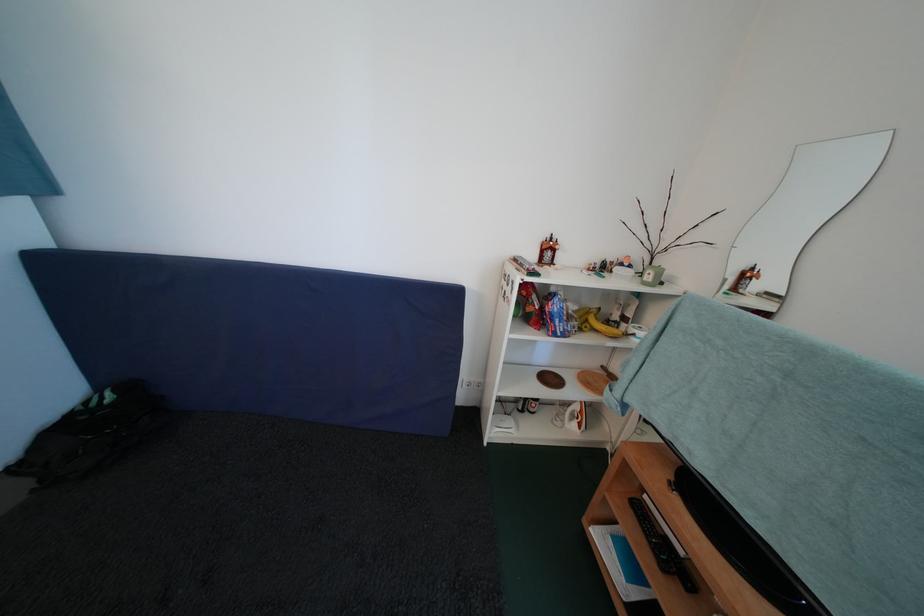
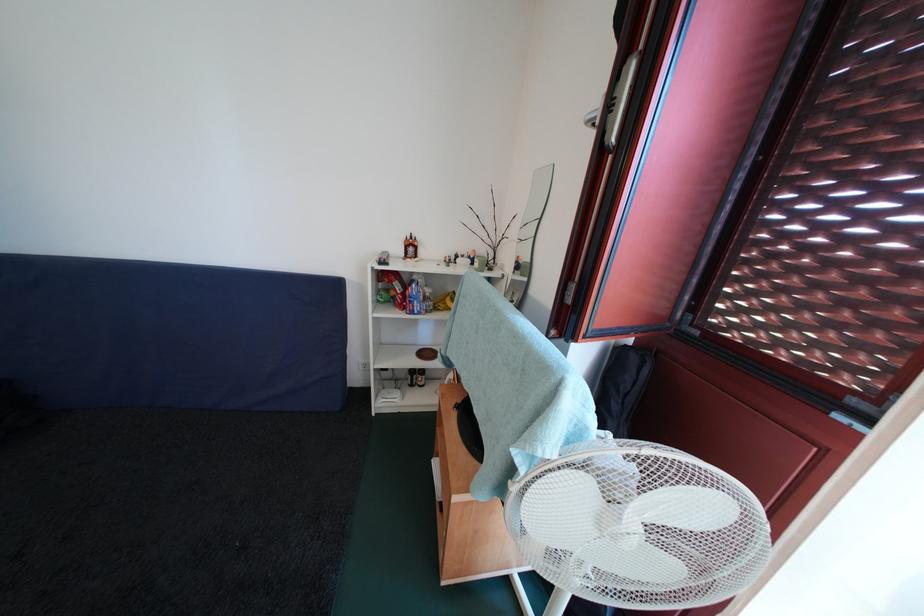
Where in the second image is the point corresponding to (x=555, y=245) from the first image?

(416, 243)